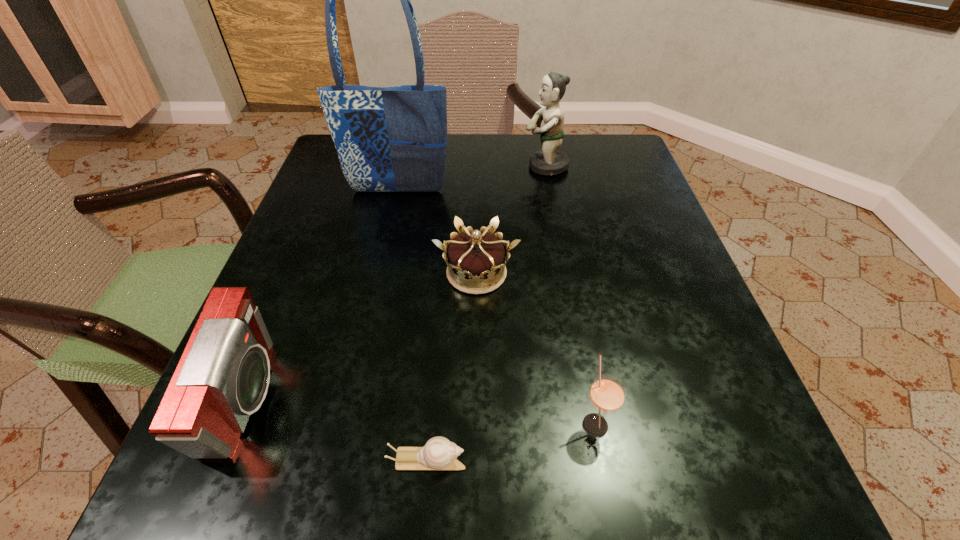
You are a GUI agent. You are given a task and a screenshot of the screen. Output one action in this format:
    pyautogui.click(x=<x>, y=<y>)
    Task: Click on the vacant space at the right edge
    This screenshot has width=960, height=540.
    Given the screenshot: What is the action you would take?
    pyautogui.click(x=724, y=395)

Where is `vacant space at the far left corner of the desktop`? vacant space at the far left corner of the desktop is located at coordinates (331, 165).

Where is `vacant space at the far right corner of the desktop`? The width and height of the screenshot is (960, 540). vacant space at the far right corner of the desktop is located at coordinates (633, 179).

At what (x,y) coordinates should I click in order to perform the action: click on free region at the near right corner of the desktop. Please return your answer as a coordinate pair (x, y). Looking at the image, I should click on (733, 509).

This screenshot has width=960, height=540. In order to click on free space between the second shortest object and the figurine in this screenshot , I will do `click(511, 220)`.

Image resolution: width=960 pixels, height=540 pixels. Find the location of `vacant area that lies between the escargot and the shopping bag`. vacant area that lies between the escargot and the shopping bag is located at coordinates (413, 326).

The width and height of the screenshot is (960, 540). In order to click on free area in between the camera and the escargot in this screenshot , I will do `click(337, 430)`.

You are a GUI agent. You are given a task and a screenshot of the screen. Output one action in this format:
    pyautogui.click(x=<x>, y=<y>)
    Task: Click on the unoccupied position between the tallest object and the figurine
    
    Given the screenshot: What is the action you would take?
    pyautogui.click(x=471, y=179)

Locate an element on the screen. vacant area that lies between the escargot and the shopping bag is located at coordinates (413, 326).

Locate an element on the screen. The height and width of the screenshot is (540, 960). empty space that is in between the straw and the fifth nearest object is located at coordinates (496, 307).